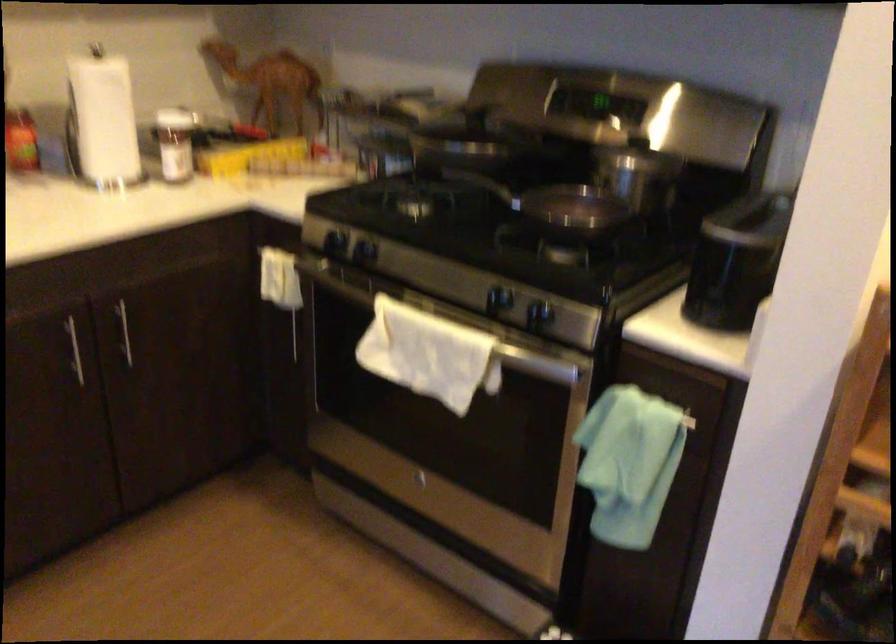
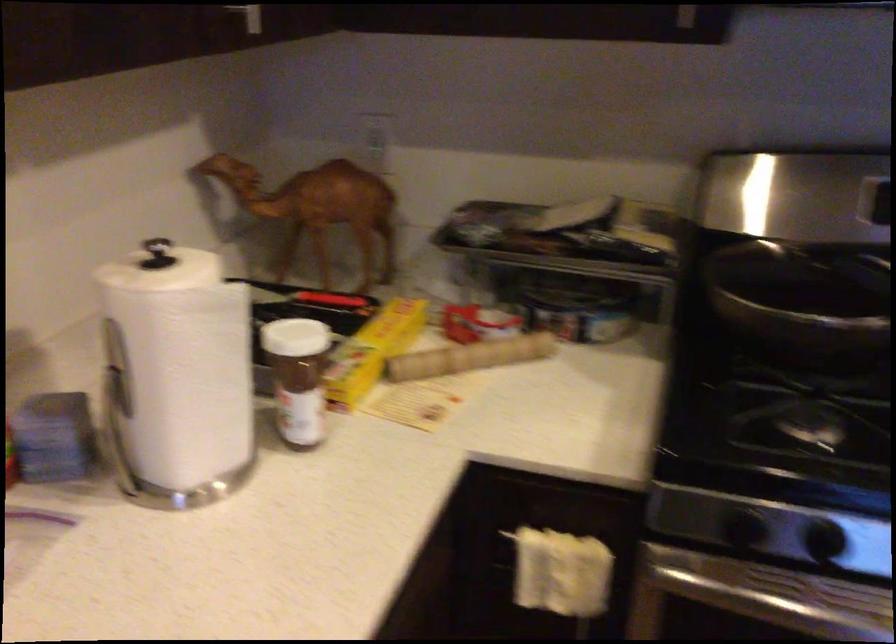
The point at (161, 131) is marked in the first image. Where is the corresponding point in the second image?

(297, 377)